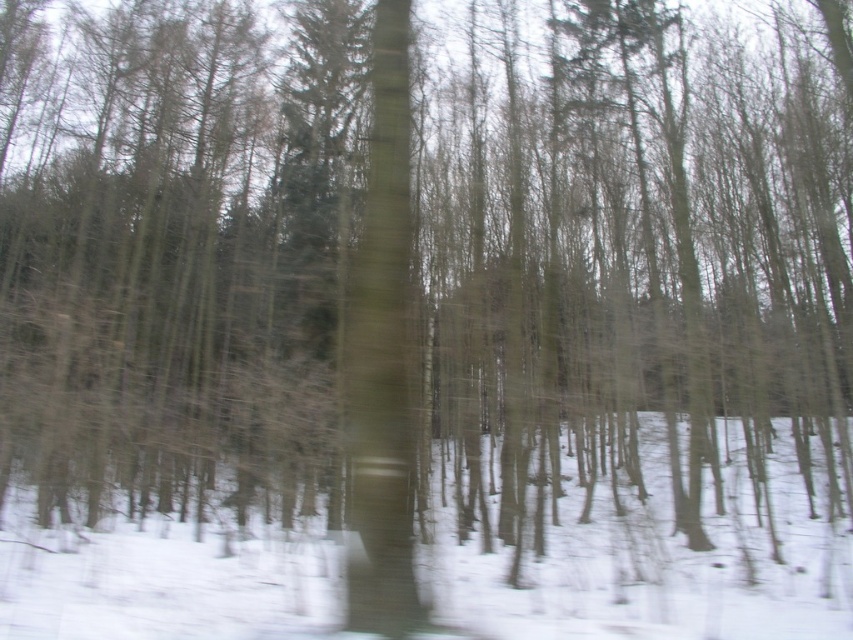
You are standing in a winter forest and want to take a photo of two points marked in the scene. One is at coordinate point (117, 525) and the other at point (367, 196). Which point will appear closer to you in the photo?

Point (117, 525) is further to the camera than point (367, 196), so point (367, 196) will appear closer in the photo.

You are an animal trying to cross the winter forest. You see the white powdery snow at center and the smooth bark tree trunk at center. Which one is larger in size?

The white powdery snow at center is bigger than the smooth bark tree trunk at center.